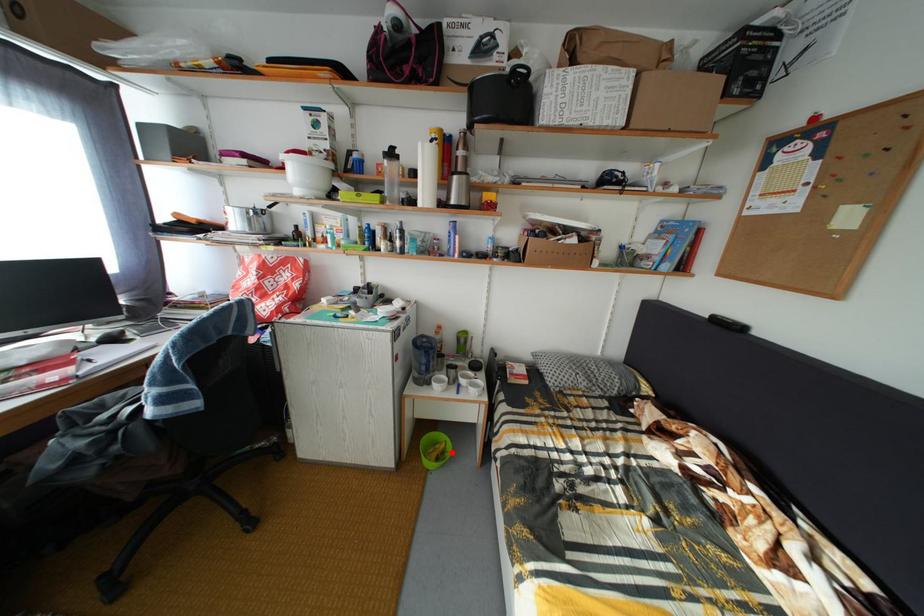
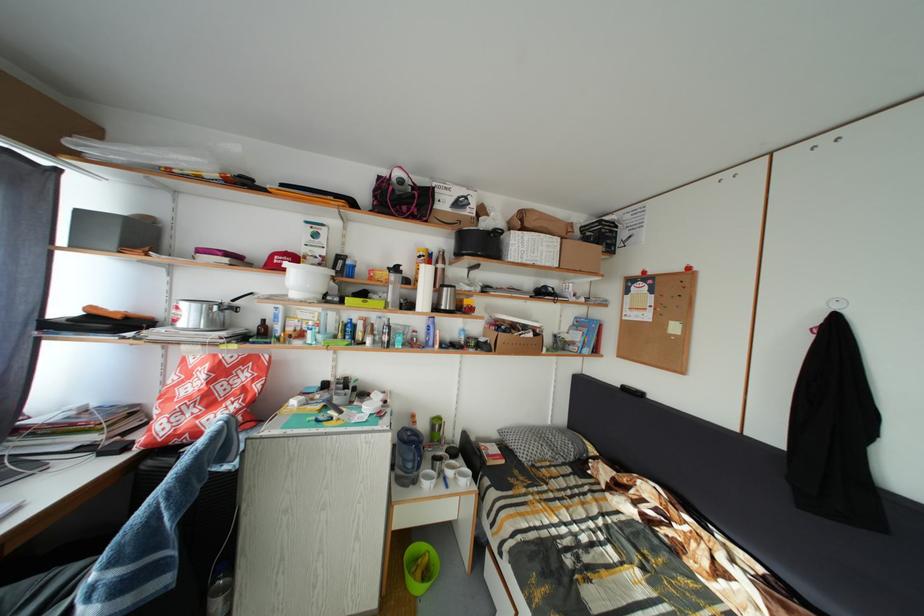
The point at the highlighted location is marked in the first image. Where is the corresponding point in the second image?

(435, 565)